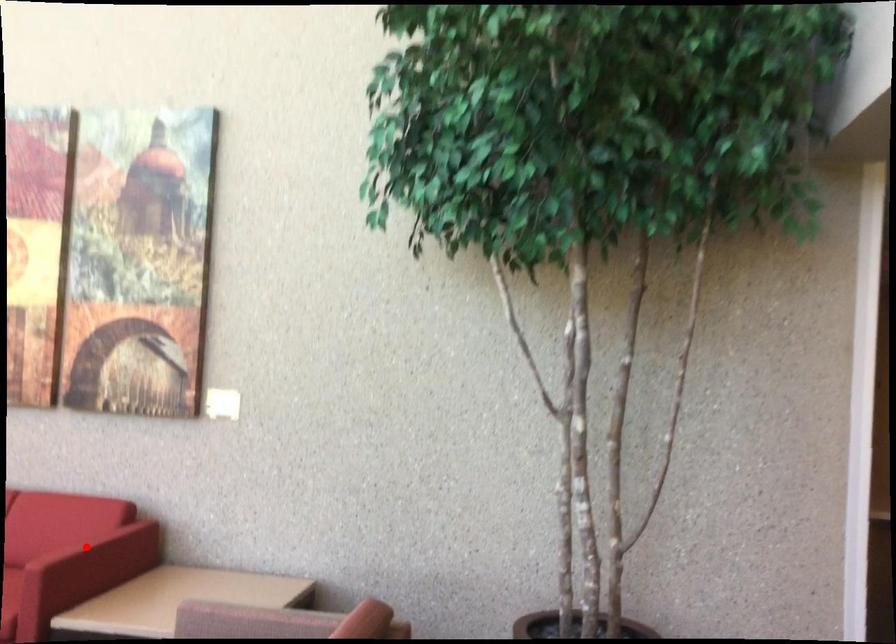
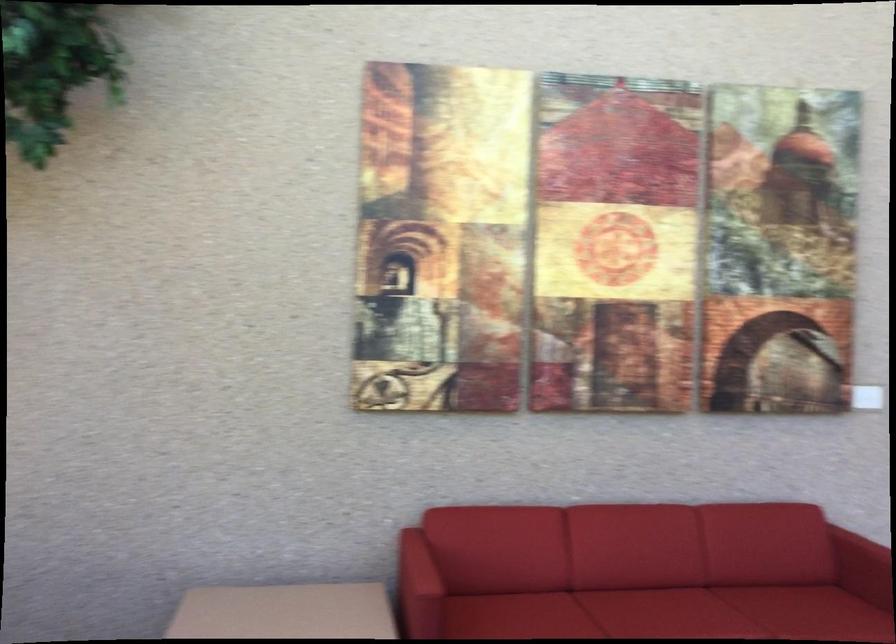
Locate, in the second image, the point that corresponds to the highlighted location in the first image.

(864, 558)